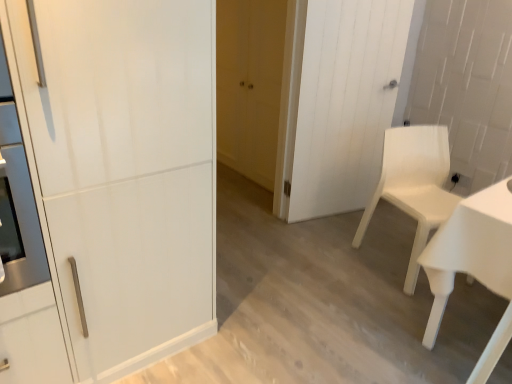
Question: Does white plastic chair at right turn towards white wood door at center, the 3th door positioned from the left?

Choices:
 (A) yes
 (B) no

Answer: (B)

Question: Does white plastic chair at right have a lesser width compared to white wood door at center, the 1th door when ordered from right to left?

Choices:
 (A) yes
 (B) no

Answer: (B)

Question: Considering the relative sizes of white plastic chair at right and white wood door at center, the 3th door positioned from the left, in the image provided, is white plastic chair at right taller than white wood door at center, the 3th door positioned from the left,?

Choices:
 (A) yes
 (B) no

Answer: (B)

Question: Considering the relative sizes of white plastic chair at right and white wood door at center, arranged as the second door when viewed from the front, in the image provided, is white plastic chair at right smaller than white wood door at center, arranged as the second door when viewed from the front,?

Choices:
 (A) no
 (B) yes

Answer: (A)

Question: From a real-world perspective, is white plastic chair at right below white wood door at center, the 1th door when ordered from right to left?

Choices:
 (A) no
 (B) yes

Answer: (B)

Question: Is white plastic chair at right at the left side of white wood door at center, arranged as the second door when viewed from the front?

Choices:
 (A) yes
 (B) no

Answer: (B)

Question: Considering the relative sizes of white wood door at center, the second door when ordered from back to front, and white plastic chair at right in the image provided, is white wood door at center, the second door when ordered from back to front, thinner than white plastic chair at right?

Choices:
 (A) yes
 (B) no

Answer: (A)

Question: Does white wood door at center, the 1th door when ordered from right to left, have a lesser height compared to white plastic chair at right?

Choices:
 (A) yes
 (B) no

Answer: (B)

Question: Is white wood door at center, the 1th door when ordered from right to left, placed right next to white plastic chair at right?

Choices:
 (A) no
 (B) yes

Answer: (A)

Question: Does white wood door at center, the 1th door when ordered from right to left, appear on the left side of white plastic chair at right?

Choices:
 (A) yes
 (B) no

Answer: (A)

Question: Does white wood door at center, the 3th door positioned from the left, appear on the right side of white plastic chair at right?

Choices:
 (A) no
 (B) yes

Answer: (A)

Question: Is white wood door at center, the second door when ordered from back to front, facing away from white plastic chair at right?

Choices:
 (A) no
 (B) yes

Answer: (B)

Question: From the image's perspective, is white wood door at center, the 1th door when ordered from right to left, above matte yellow door at center, which ranks as the second door in left-to-right order?

Choices:
 (A) no
 (B) yes

Answer: (A)